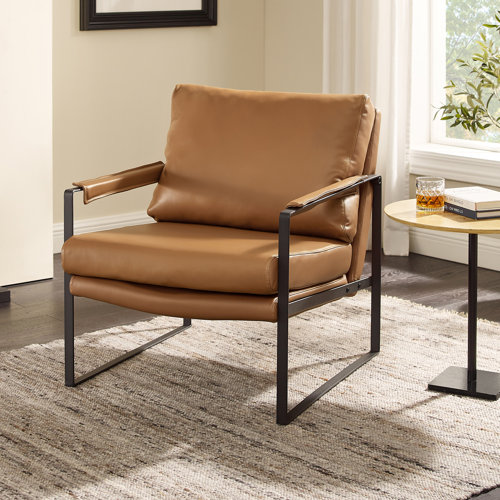
Where is `chair`? This screenshot has width=500, height=500. chair is located at coordinates (284, 305).